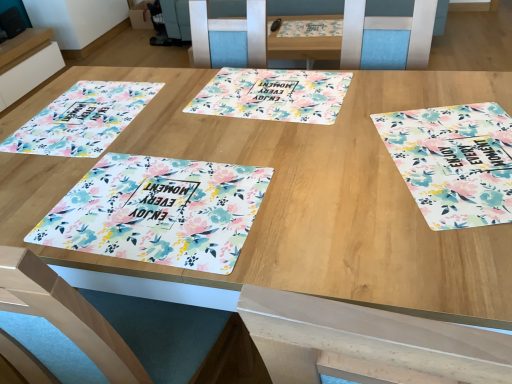
The image size is (512, 384). Identify the location of free spot behind floral printed placemat at lower left, the second tablecloth when ordered from right to left. (187, 125).